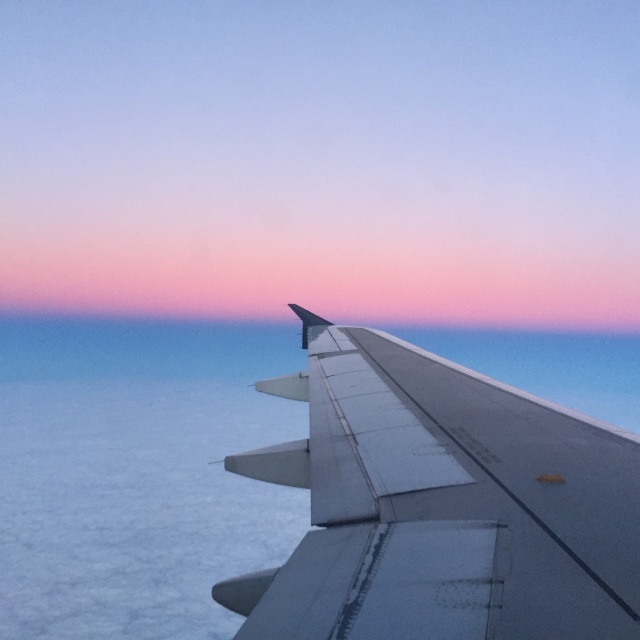
Question: Is matte white wing at center closer to the viewer compared to metallic gray wing at right?

Choices:
 (A) yes
 (B) no

Answer: (B)

Question: Among these points, which one is nearest to the camera?

Choices:
 (A) (356, 417)
 (B) (58, 164)

Answer: (A)

Question: Is matte white wing at center bigger than metallic gray wing at right?

Choices:
 (A) no
 (B) yes

Answer: (B)

Question: Which object is closer to the camera taking this photo?

Choices:
 (A) metallic gray wing at right
 (B) matte white wing at center

Answer: (A)

Question: Which of the following is the farthest from the observer?

Choices:
 (A) matte white wing at center
 (B) metallic gray wing at right

Answer: (A)

Question: In this image, where is matte white wing at center located relative to metallic gray wing at right?

Choices:
 (A) below
 (B) above

Answer: (B)